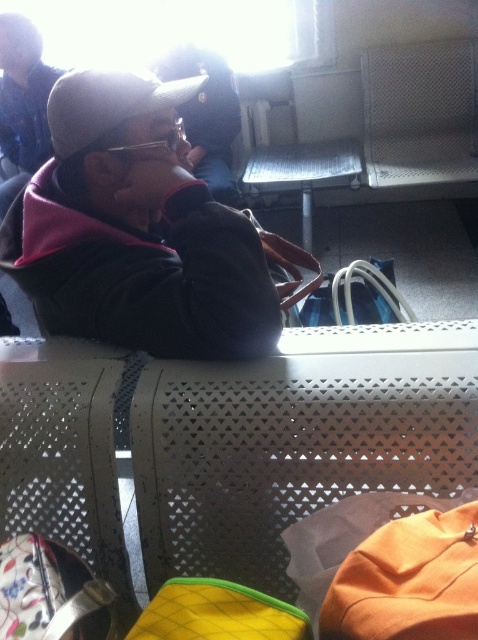
You are a photographer taking a picture of the scene. You notice the matte black cap at upper left and the matte black jacket at upper center. Which object would appear bigger in your photo?

The matte black cap at upper left would appear bigger in the photo because it has a larger size compared to the matte black jacket at upper center.